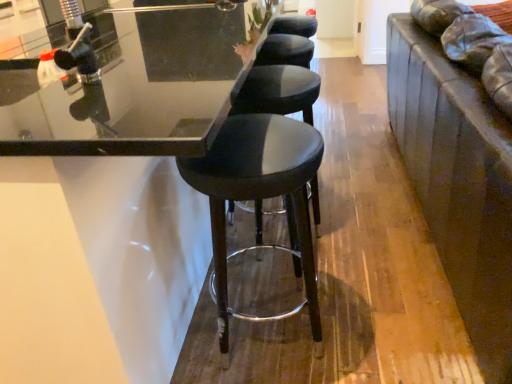
Find the location of a particular element. The height and width of the screenshot is (384, 512). free space in front of black leather stool at center, which is counted as the second stool, starting from the front is located at coordinates (302, 283).